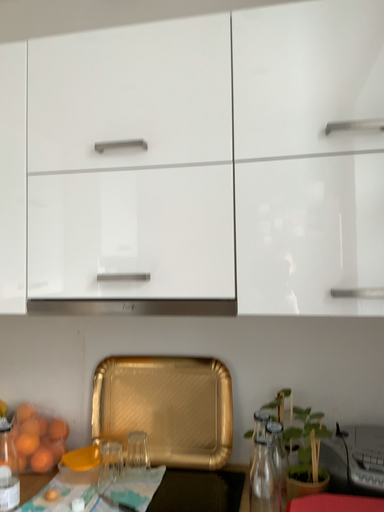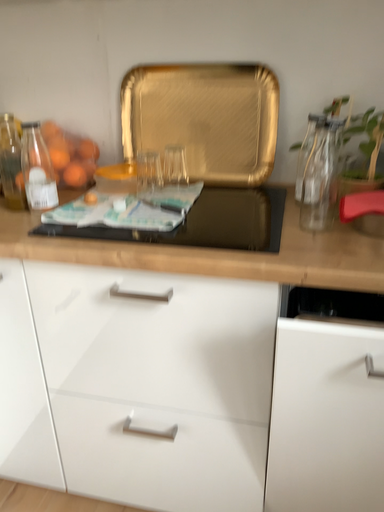
Question: Which way did the camera rotate in the video?

Choices:
 (A) rotated upward
 (B) rotated downward

Answer: (B)